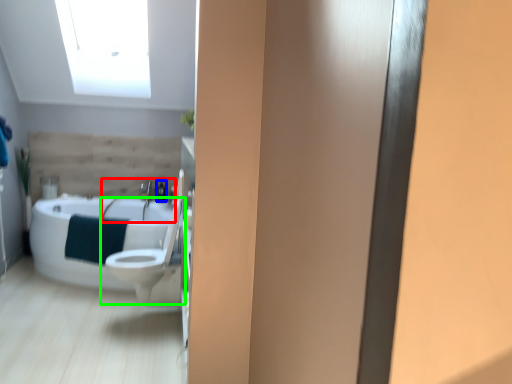
Question: Which is farther away from sink (highlighted by a red box)? toiletry (highlighted by a blue box) or toilet (highlighted by a green box)?

Choices:
 (A) toiletry
 (B) toilet

Answer: (B)